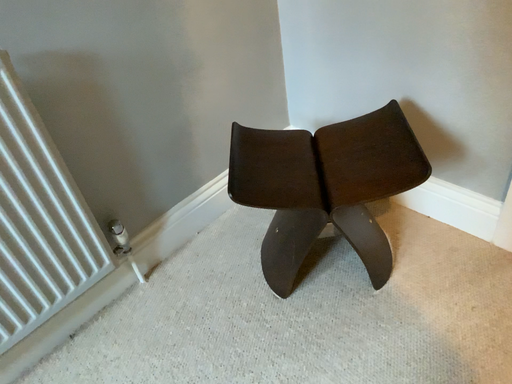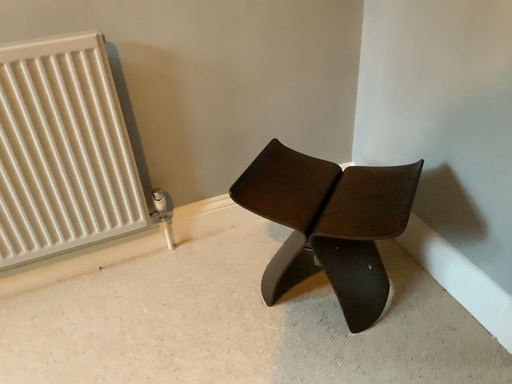
Question: Which way did the camera rotate in the video?

Choices:
 (A) rotated right
 (B) rotated left

Answer: (B)